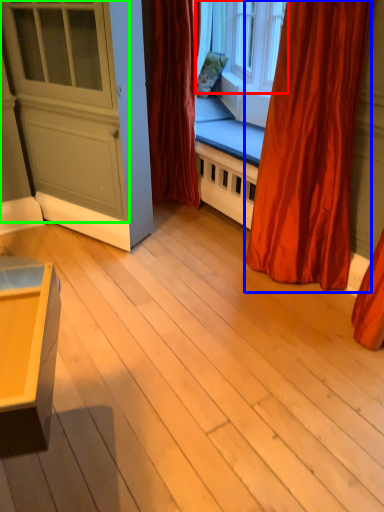
Question: Based on their relative distances, which object is farther from window (highlighted by a red box)? Choose from curtain (highlighted by a blue box) and screen door (highlighted by a green box).

Choices:
 (A) curtain
 (B) screen door

Answer: (B)